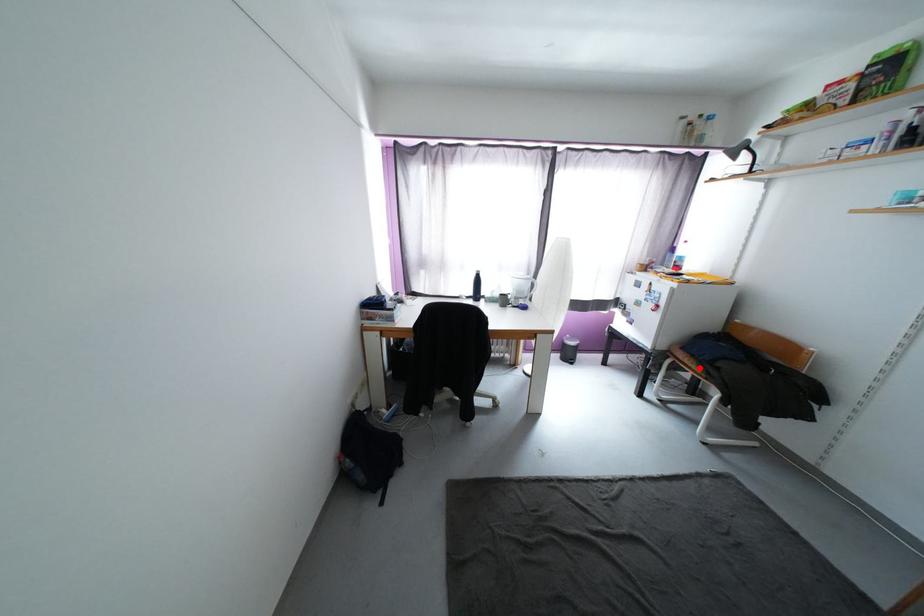
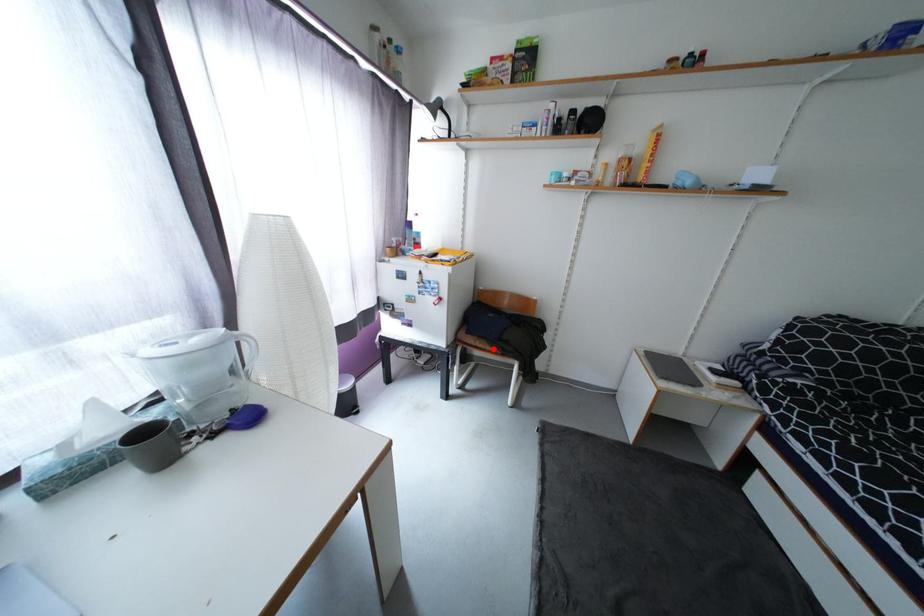
I am providing you with two images of the same scene from different viewpoints. A red point is marked on the first image and another point is marked on the second image. Are the points marked in image1 and image2 representing the same 3D position?

Yes